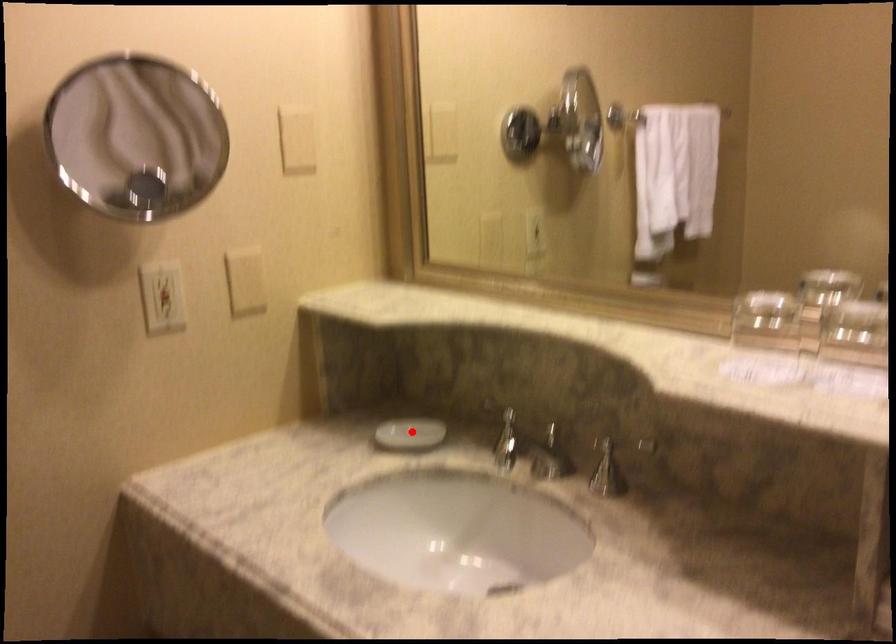
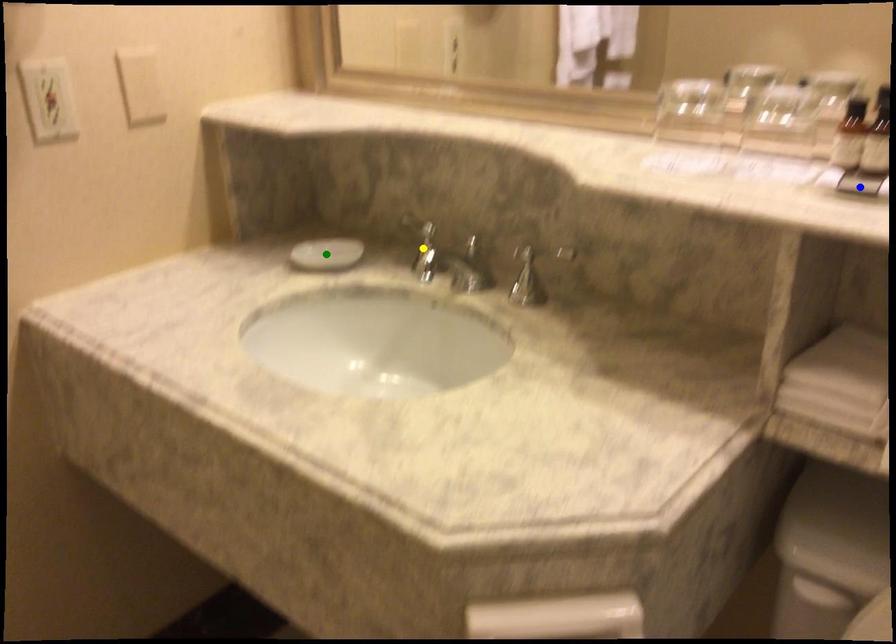
Question: I am providing you with two images of the same scene from different viewpoints. A red point is marked on the first image. You are given multiple points on the second image. In image 2, which mark is for the same physical point as the one in image 1?

Choices:
 (A) blue point
 (B) green point
 (C) yellow point

Answer: (B)